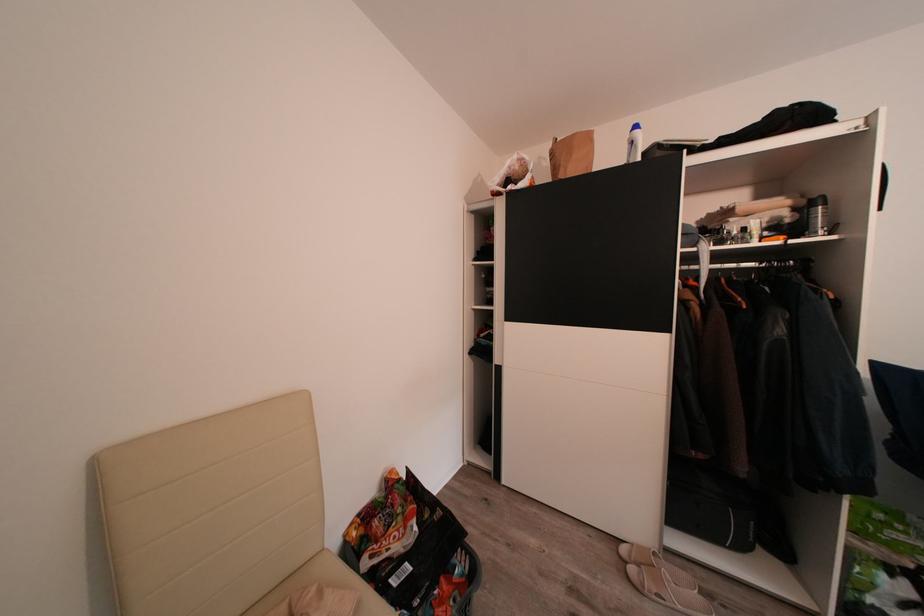
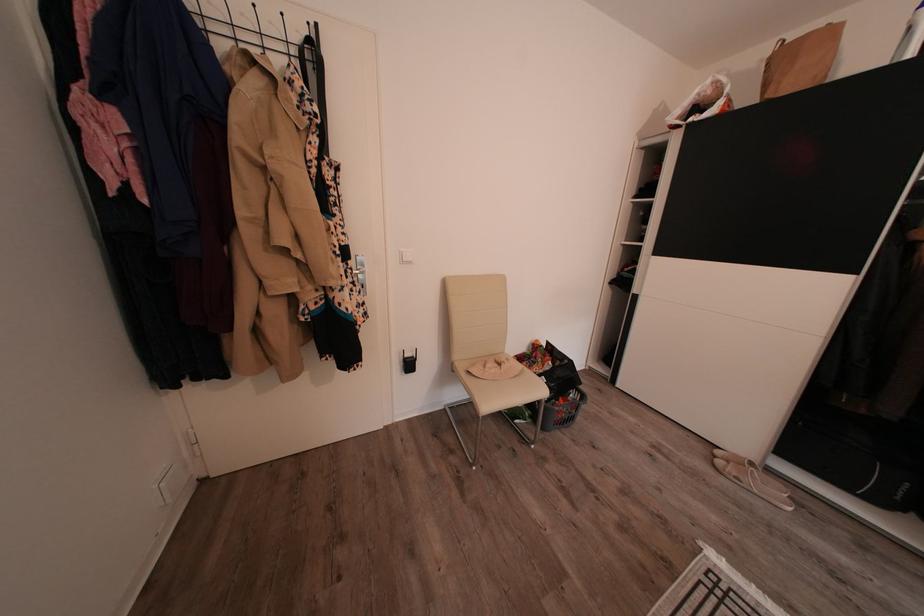
Where in the second image is the point corresponding to [564,174] from the first image?

(773, 91)